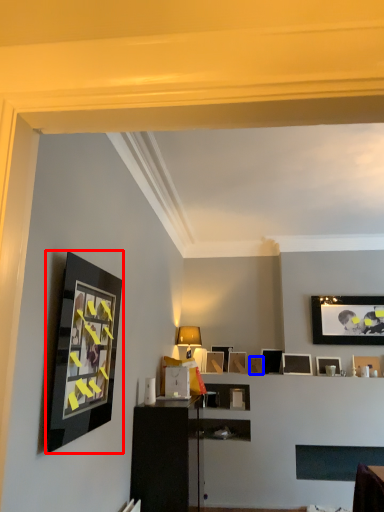
Question: Among these objects, which one is nearest to the camera, picture frame (highlighted by a red box) or picture frame (highlighted by a blue box)?

Choices:
 (A) picture frame
 (B) picture frame

Answer: (A)